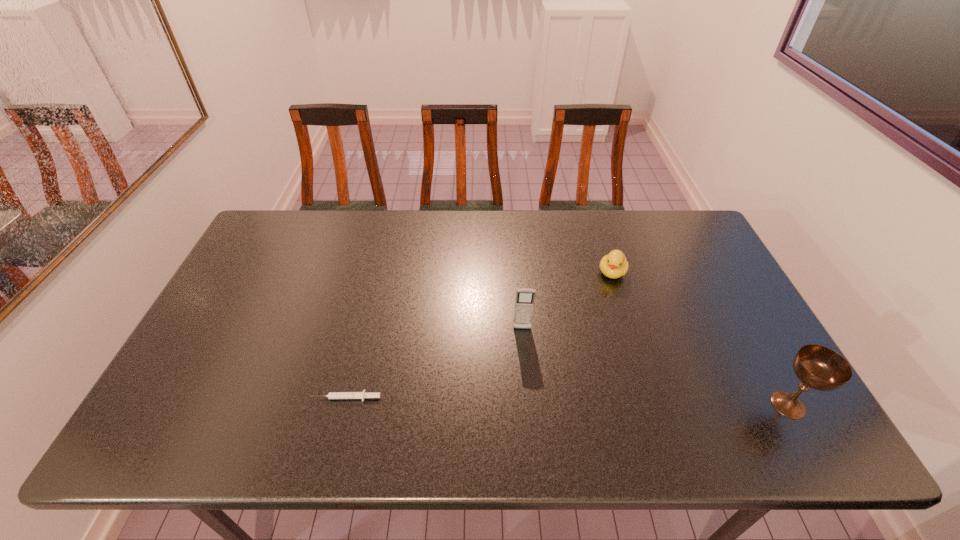
Find the location of a particular element. The image size is (960, 540). free space on the desktop that is between the syringe and the chalice and is positioned on the beak of the third object from left to right is located at coordinates (565, 401).

Identify the location of free space on the desktop that is between the syringe and the chalice and is positioned on the front-facing side of the third object from right to left. This screenshot has height=540, width=960. (524, 400).